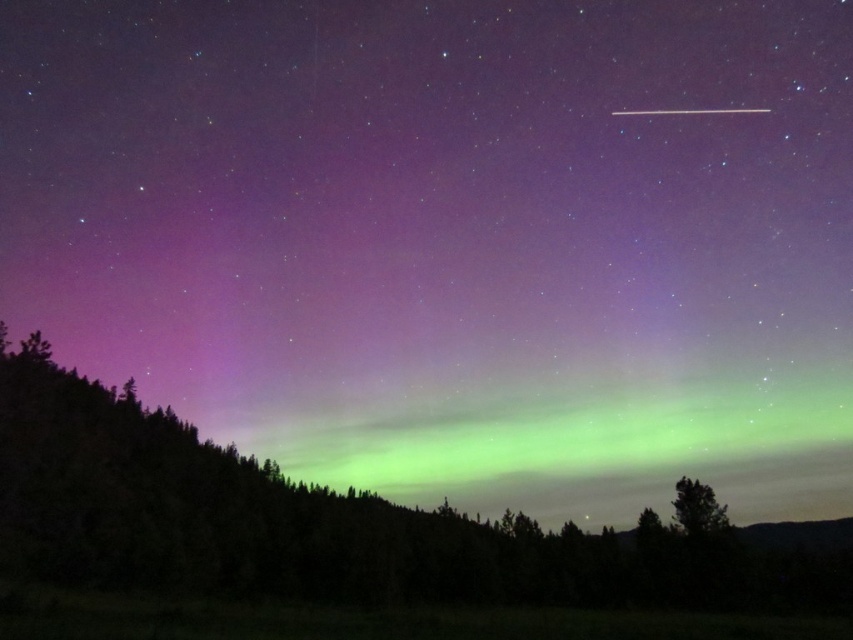
Question: Is green matte forest at lower center above green leafy tree at lower right?

Choices:
 (A) yes
 (B) no

Answer: (B)

Question: Which point is closer to the camera?

Choices:
 (A) (682, 506)
 (B) (502, 544)

Answer: (A)

Question: Does green matte forest at lower center come in front of green leafy tree at lower right?

Choices:
 (A) yes
 (B) no

Answer: (A)

Question: Is green matte forest at lower center to the left of green leafy tree at lower right from the viewer's perspective?

Choices:
 (A) no
 (B) yes

Answer: (B)